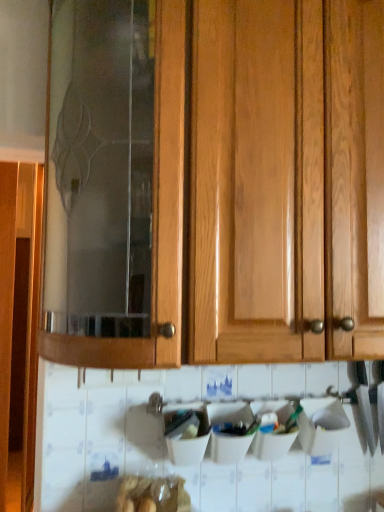
Find the location of a particular element. The image size is (384, 512). wooden cabinet at center is located at coordinates (286, 180).

Describe the element at coordinates (286, 180) in the screenshot. I see `wooden cabinet at center` at that location.

What do you see at coordinates (152, 495) in the screenshot?
I see `translucent plastic bag at lower center` at bounding box center [152, 495].

The width and height of the screenshot is (384, 512). I want to click on translucent plastic bag at lower center, so click(152, 495).

At what (x,y) coordinates should I click in order to perform the action: click on wooden cabinet at center. Please return your answer as a coordinate pair (x, y). Looking at the image, I should click on (286, 180).

Is wooden cabinet at center to the right of translucent plastic bag at lower center from the viewer's perspective?

Yes, wooden cabinet at center is to the right of translucent plastic bag at lower center.

Considering the positions of objects wooden cabinet at center and translucent plastic bag at lower center in the image provided, who is behind, wooden cabinet at center or translucent plastic bag at lower center?

translucent plastic bag at lower center is more distant.

Which is in front, point (328, 153) or point (132, 497)?

The point (328, 153) is closer.

From the image's perspective, is wooden cabinet at center positioned above or below translucent plastic bag at lower center?

From the image's perspective, wooden cabinet at center appears above translucent plastic bag at lower center.

From a real-world perspective, is wooden cabinet at center physically above translucent plastic bag at lower center?

Yes, from a real-world perspective, wooden cabinet at center is above translucent plastic bag at lower center.

Based on the photo, is wooden cabinet at center wider than translucent plastic bag at lower center?

Yes.

Between wooden cabinet at center and translucent plastic bag at lower center, which one has less height?

translucent plastic bag at lower center.

Which of these two, wooden cabinet at center or translucent plastic bag at lower center, is bigger?

wooden cabinet at center is bigger.

Which is correct: wooden cabinet at center is inside translucent plastic bag at lower center, or outside of it?

wooden cabinet at center is not enclosed by translucent plastic bag at lower center.

Is wooden cabinet at center placed right next to translucent plastic bag at lower center?

No, wooden cabinet at center is not with translucent plastic bag at lower center.

Is wooden cabinet at center aimed at translucent plastic bag at lower center?

No, wooden cabinet at center is not facing towards translucent plastic bag at lower center.

What's the angular difference between wooden cabinet at center and translucent plastic bag at lower center's facing directions?

1 degrees.

Locate an element on the screen. This screenshot has height=512, width=384. food lying below the wooden cabinet at center (from the image's perspective) is located at coordinates (152, 495).

Considering the relative positions of translucent plastic bag at lower center and wooden cabinet at center in the image provided, is translucent plastic bag at lower center to the left or to the right of wooden cabinet at center?

Clearly, translucent plastic bag at lower center is on the left of wooden cabinet at center in the image.

Is translucent plastic bag at lower center positioned behind wooden cabinet at center?

Yes, translucent plastic bag at lower center is further from the camera.

Which is in front, point (175, 480) or point (270, 16)?

Positioned in front is point (270, 16).

From the image's perspective, which is below, translucent plastic bag at lower center or wooden cabinet at center?

translucent plastic bag at lower center is shown below in the image.

Looking at this image, from a real-world perspective, is translucent plastic bag at lower center below wooden cabinet at center?

Yes.

Considering the sizes of translucent plastic bag at lower center and wooden cabinet at center in the image, is translucent plastic bag at lower center wider or thinner than wooden cabinet at center?

Considering their sizes, translucent plastic bag at lower center looks slimmer than wooden cabinet at center.

Considering the relative sizes of translucent plastic bag at lower center and wooden cabinet at center in the image provided, is translucent plastic bag at lower center taller than wooden cabinet at center?

No, translucent plastic bag at lower center is not taller than wooden cabinet at center.

Is translucent plastic bag at lower center smaller than wooden cabinet at center?

Correct, translucent plastic bag at lower center occupies less space than wooden cabinet at center.

Would you say translucent plastic bag at lower center is outside wooden cabinet at center?

Yes, translucent plastic bag at lower center is outside of wooden cabinet at center.

Looking at this image, is translucent plastic bag at lower center far from wooden cabinet at center?

translucent plastic bag at lower center is near wooden cabinet at center, not far away.

Could you tell me if translucent plastic bag at lower center is turned towards wooden cabinet at center?

No, translucent plastic bag at lower center is not facing towards wooden cabinet at center.

How many degrees apart are the facing directions of translucent plastic bag at lower center and wooden cabinet at center?

1 degrees separate the facing orientations of translucent plastic bag at lower center and wooden cabinet at center.

Measure the distance between translucent plastic bag at lower center and wooden cabinet at center.

A distance of 74.31 centimeters exists between translucent plastic bag at lower center and wooden cabinet at center.

This screenshot has height=512, width=384. I want to click on food behind the wooden cabinet at center, so [x=152, y=495].

Find the location of a particular element. The image size is (384, 512). cabinetry in front of the translucent plastic bag at lower center is located at coordinates (286, 180).

This screenshot has width=384, height=512. What are the coordinates of `food below the wooden cabinet at center (from a real-world perspective)` in the screenshot? It's located at (152, 495).